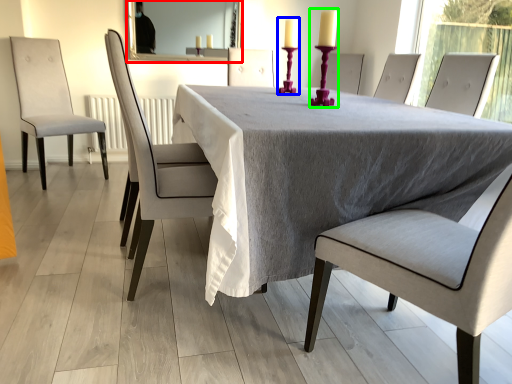
Question: Considering the real-world distances, which object is farthest from mirror (highlighted by a red box)? candle holder (highlighted by a blue box) or candle holder (highlighted by a green box)?

Choices:
 (A) candle holder
 (B) candle holder

Answer: (B)